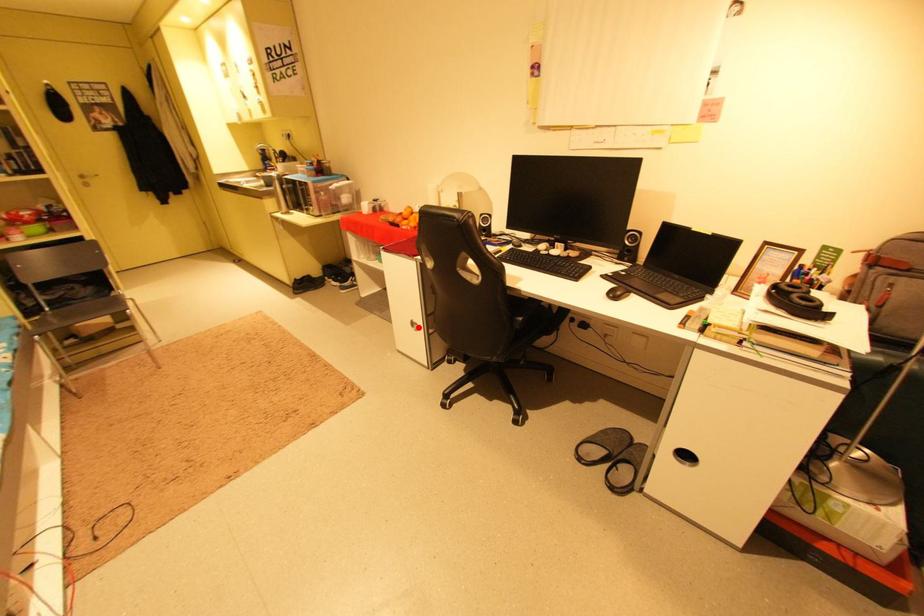
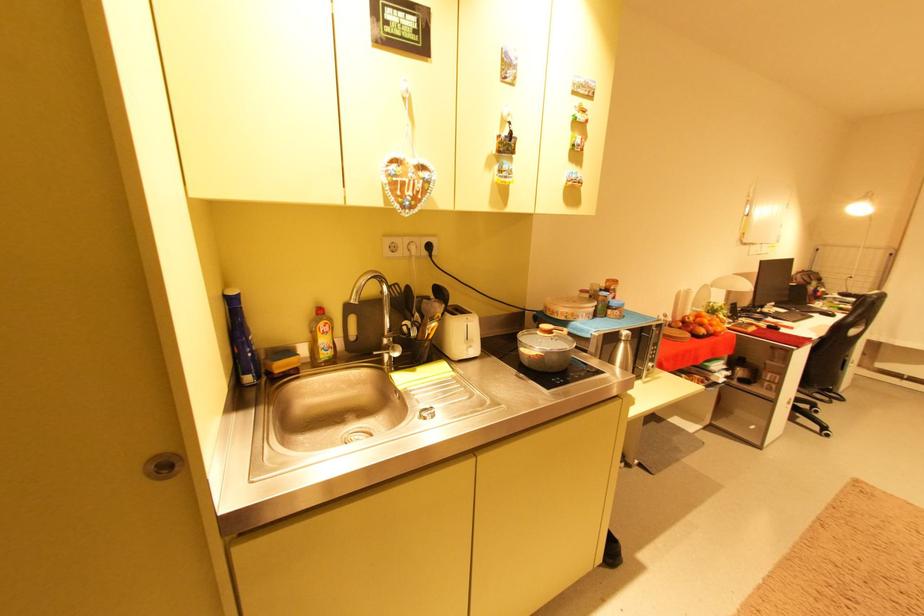
Question: I am providing you with two images of the same scene from different viewpoints. A red point is marked on the first image. At the location where the point appears in image 1, is it still visible in image 2?

Choices:
 (A) Yes
 (B) No

Answer: (B)